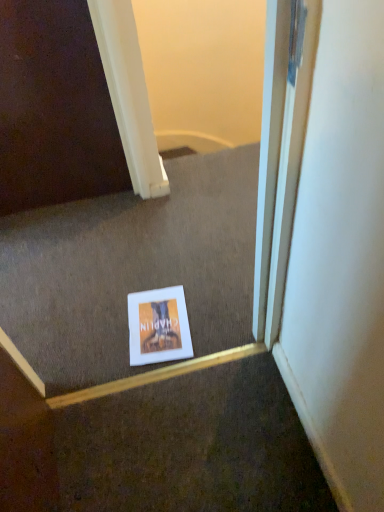
This screenshot has width=384, height=512. In order to click on empty space that is to the right of matte cardboard book at center in this screenshot , I will do `click(210, 312)`.